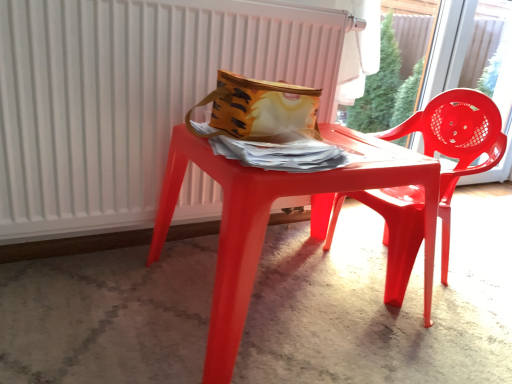
Question: Can you confirm if glossy plastic table at center is smaller than glossy plastic chair at right?

Choices:
 (A) yes
 (B) no

Answer: (B)

Question: Considering the relative sizes of glossy plastic table at center and glossy plastic chair at right in the image provided, is glossy plastic table at center wider than glossy plastic chair at right?

Choices:
 (A) no
 (B) yes

Answer: (B)

Question: Is glossy plastic table at center positioned in front of glossy plastic chair at right?

Choices:
 (A) no
 (B) yes

Answer: (B)

Question: Is glossy plastic table at center taller than glossy plastic chair at right?

Choices:
 (A) yes
 (B) no

Answer: (B)

Question: Are glossy plastic table at center and glossy plastic chair at right making contact?

Choices:
 (A) no
 (B) yes

Answer: (A)

Question: From a real-world perspective, is glossy plastic table at center positioned over glossy plastic chair at right based on gravity?

Choices:
 (A) yes
 (B) no

Answer: (B)

Question: Can you see transparent plastic chair at upper right touching matte yellow fabric bag at center?

Choices:
 (A) no
 (B) yes

Answer: (A)

Question: Is transparent plastic chair at upper right looking in the opposite direction of matte yellow fabric bag at center?

Choices:
 (A) yes
 (B) no

Answer: (B)

Question: Considering the relative sizes of transparent plastic chair at upper right and matte yellow fabric bag at center in the image provided, is transparent plastic chair at upper right wider than matte yellow fabric bag at center?

Choices:
 (A) yes
 (B) no

Answer: (B)

Question: Considering the relative sizes of transparent plastic chair at upper right and matte yellow fabric bag at center in the image provided, is transparent plastic chair at upper right smaller than matte yellow fabric bag at center?

Choices:
 (A) no
 (B) yes

Answer: (A)

Question: From a real-world perspective, is transparent plastic chair at upper right on top of matte yellow fabric bag at center?

Choices:
 (A) no
 (B) yes

Answer: (A)

Question: From the image's perspective, would you say transparent plastic chair at upper right is positioned over matte yellow fabric bag at center?

Choices:
 (A) no
 (B) yes

Answer: (B)

Question: Is glossy plastic chair at right bigger than transparent plastic chair at upper right?

Choices:
 (A) yes
 (B) no

Answer: (A)